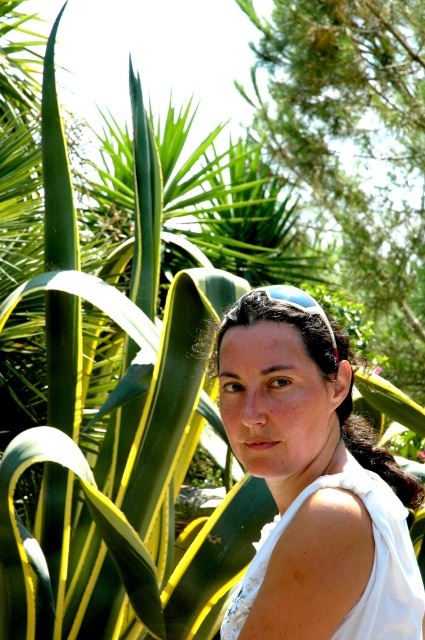
You are a photographer planning to take a portrait of someone in this scene. You want to position the person so that the white fabric at center and the white cotton dress at right are both visible in the frame. Which object should be placed closer to the camera to ensure both are in the shot?

The white fabric at center should be placed closer to the camera because it is positioned to the left of the white cotton dress at right, so moving it forward will keep both objects within the frame.

You are a fashion designer observing the scene. You see the white fabric at center and the white cotton dress at right. Which one would you choose to create a larger garment if you want to use the entire material without any leftover?

The white fabric at center is larger in size than the white cotton dress at right, so you should choose the white fabric at center to create a larger garment without leftover material.

You are standing in a garden and see two points marked on the ground. The first point is at coordinates point (407,547) and the second point is at point (348,477). Which point is closer to you?

Point (348,477) is closer to you because point (407,547) is behind point (348,477).